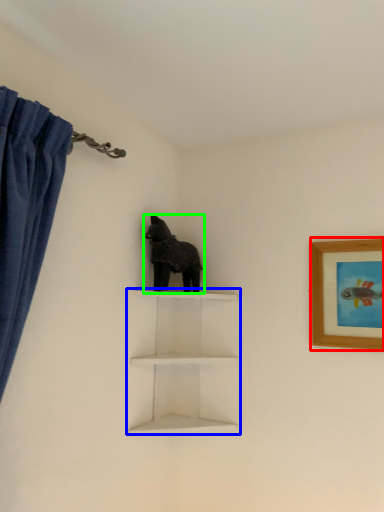
Question: Which object is the closest to the picture frame (highlighted by a red box)? Choose among these: shelf (highlighted by a blue box) or animal (highlighted by a green box).

Choices:
 (A) shelf
 (B) animal

Answer: (A)